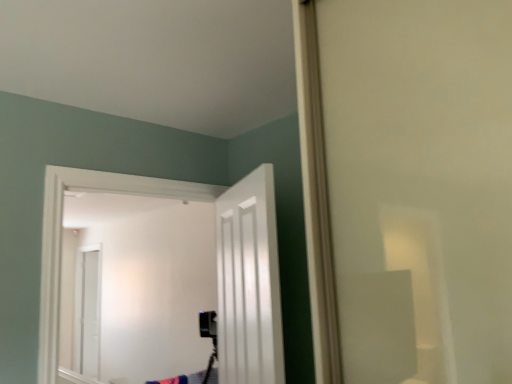
This screenshot has width=512, height=384. I want to click on white glossy door at center, which appears as the second door when viewed from the left, so click(249, 282).

The width and height of the screenshot is (512, 384). Describe the element at coordinates (249, 282) in the screenshot. I see `white glossy door at center, the 1th door in the right-to-left sequence` at that location.

Describe the element at coordinates (159, 278) in the screenshot. I see `white glossy door at center, the 2th door positioned from the right` at that location.

Where is `white glossy door at center, the 2th door positioned from the right`? white glossy door at center, the 2th door positioned from the right is located at coordinates (159, 278).

This screenshot has width=512, height=384. In order to click on white glossy door at center, the 1th door in the right-to-left sequence in this screenshot , I will do `click(249, 282)`.

Between white glossy door at center, the 2th door positioned from the right, and white glossy door at center, which appears as the second door when viewed from the left, which one appears on the right side from the viewer's perspective?

white glossy door at center, which appears as the second door when viewed from the left.

Which object is further away from the camera taking this photo, white glossy door at center, which appears as the first door when viewed from the left, or white glossy door at center, the 1th door in the right-to-left sequence?

white glossy door at center, which appears as the first door when viewed from the left, is behind.

Which point is more forward, (113, 340) or (222, 288)?

The point (222, 288) is closer.

From the image's perspective, who appears lower, white glossy door at center, the 2th door positioned from the right, or white glossy door at center, which appears as the second door when viewed from the left?

white glossy door at center, the 2th door positioned from the right, appears lower in the image.

From a real-world perspective, is white glossy door at center, which appears as the first door when viewed from the left, positioned over white glossy door at center, the 1th door in the right-to-left sequence, based on gravity?

Yes.

Does white glossy door at center, which appears as the first door when viewed from the left, have a greater width compared to white glossy door at center, which appears as the second door when viewed from the left?

Yes, white glossy door at center, which appears as the first door when viewed from the left, is wider than white glossy door at center, which appears as the second door when viewed from the left.

Which of these two, white glossy door at center, which appears as the first door when viewed from the left, or white glossy door at center, which appears as the second door when viewed from the left, stands shorter?

Standing shorter between the two is white glossy door at center, which appears as the second door when viewed from the left.

Is white glossy door at center, which appears as the first door when viewed from the left, smaller than white glossy door at center, the 1th door in the right-to-left sequence?

No.

In the scene shown: Does white glossy door at center, the 2th door positioned from the right, contain white glossy door at center, which appears as the second door when viewed from the left?

Definitely not — white glossy door at center, which appears as the second door when viewed from the left, is not inside white glossy door at center, the 2th door positioned from the right.

Is white glossy door at center, the 2th door positioned from the right, far away from white glossy door at center, the 1th door in the right-to-left sequence?

Yes, white glossy door at center, the 2th door positioned from the right, and white glossy door at center, the 1th door in the right-to-left sequence, are located far from each other.

Does white glossy door at center, the 2th door positioned from the right, turn towards white glossy door at center, which appears as the second door when viewed from the left?

Yes, white glossy door at center, the 2th door positioned from the right, faces towards white glossy door at center, which appears as the second door when viewed from the left.

How different are the orientations of white glossy door at center, the 2th door positioned from the right, and white glossy door at center, the 1th door in the right-to-left sequence, in degrees?

There is a 65.3-degree angle between the facing directions of white glossy door at center, the 2th door positioned from the right, and white glossy door at center, the 1th door in the right-to-left sequence.

Find the location of a particular element. The image size is (512, 384). door located on the right of white glossy door at center, which appears as the first door when viewed from the left is located at coordinates [x=249, y=282].

Considering the relative positions of white glossy door at center, the 1th door in the right-to-left sequence, and white glossy door at center, the 2th door positioned from the right, in the image provided, is white glossy door at center, the 1th door in the right-to-left sequence, to the left or to the right of white glossy door at center, the 2th door positioned from the right,?

white glossy door at center, the 1th door in the right-to-left sequence, is to the right of white glossy door at center, the 2th door positioned from the right.

Is white glossy door at center, the 1th door in the right-to-left sequence, in front of or behind white glossy door at center, which appears as the first door when viewed from the left, in the image?

In the image, white glossy door at center, the 1th door in the right-to-left sequence, appears in front of white glossy door at center, which appears as the first door when viewed from the left.

Considering the points (270, 172) and (200, 305), which point is behind, point (270, 172) or point (200, 305)?

Positioned behind is point (200, 305).

From the image's perspective, which one is positioned lower, white glossy door at center, which appears as the second door when viewed from the left, or white glossy door at center, the 2th door positioned from the right?

white glossy door at center, the 2th door positioned from the right, is shown below in the image.

From a real-world perspective, who is located lower, white glossy door at center, the 1th door in the right-to-left sequence, or white glossy door at center, which appears as the first door when viewed from the left?

white glossy door at center, the 1th door in the right-to-left sequence, from a real-world perspective.

Considering the relative sizes of white glossy door at center, the 1th door in the right-to-left sequence, and white glossy door at center, which appears as the first door when viewed from the left, in the image provided, is white glossy door at center, the 1th door in the right-to-left sequence, wider than white glossy door at center, which appears as the first door when viewed from the left,?

No, white glossy door at center, the 1th door in the right-to-left sequence, is not wider than white glossy door at center, which appears as the first door when viewed from the left.

From their relative heights in the image, would you say white glossy door at center, the 1th door in the right-to-left sequence, is taller or shorter than white glossy door at center, the 2th door positioned from the right?

Clearly, white glossy door at center, the 1th door in the right-to-left sequence, is shorter compared to white glossy door at center, the 2th door positioned from the right.

Considering the sizes of objects white glossy door at center, the 1th door in the right-to-left sequence, and white glossy door at center, which appears as the first door when viewed from the left, in the image provided, who is bigger, white glossy door at center, the 1th door in the right-to-left sequence, or white glossy door at center, which appears as the first door when viewed from the left,?

white glossy door at center, which appears as the first door when viewed from the left, is bigger.

Is white glossy door at center, the 1th door in the right-to-left sequence, inside the boundaries of white glossy door at center, the 2th door positioned from the right, or outside?

white glossy door at center, the 1th door in the right-to-left sequence, exists outside the volume of white glossy door at center, the 2th door positioned from the right.

Is white glossy door at center, which appears as the second door when viewed from the left, beside white glossy door at center, the 2th door positioned from the right?

white glossy door at center, which appears as the second door when viewed from the left, and white glossy door at center, the 2th door positioned from the right, are clearly separated.

Is white glossy door at center, which appears as the second door when viewed from the left, turned away from white glossy door at center, the 2th door positioned from the right?

white glossy door at center, which appears as the second door when viewed from the left, is not turned away from white glossy door at center, the 2th door positioned from the right.

Locate an element on the screen. This screenshot has height=384, width=512. door above the white glossy door at center, which appears as the first door when viewed from the left (from the image's perspective) is located at coordinates (249, 282).

Image resolution: width=512 pixels, height=384 pixels. Identify the location of door below the white glossy door at center, which appears as the first door when viewed from the left (from a real-world perspective). (249, 282).

Where is `door that is above the white glossy door at center, which appears as the first door when viewed from the left (from the image's perspective)`? door that is above the white glossy door at center, which appears as the first door when viewed from the left (from the image's perspective) is located at coordinates (249, 282).